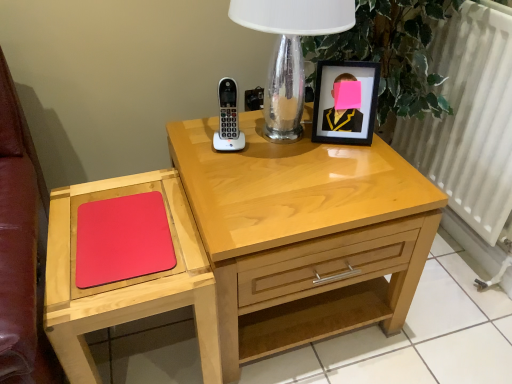
Find the location of a particular element. The width and height of the screenshot is (512, 384). vacant area situated below clear glass table lamp at upper center (from a real-world perspective) is located at coordinates (274, 140).